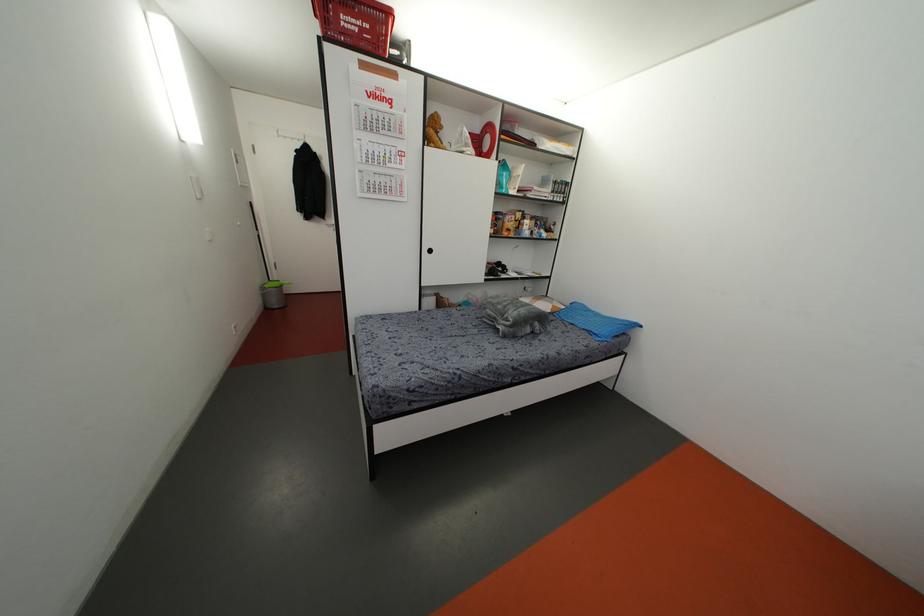
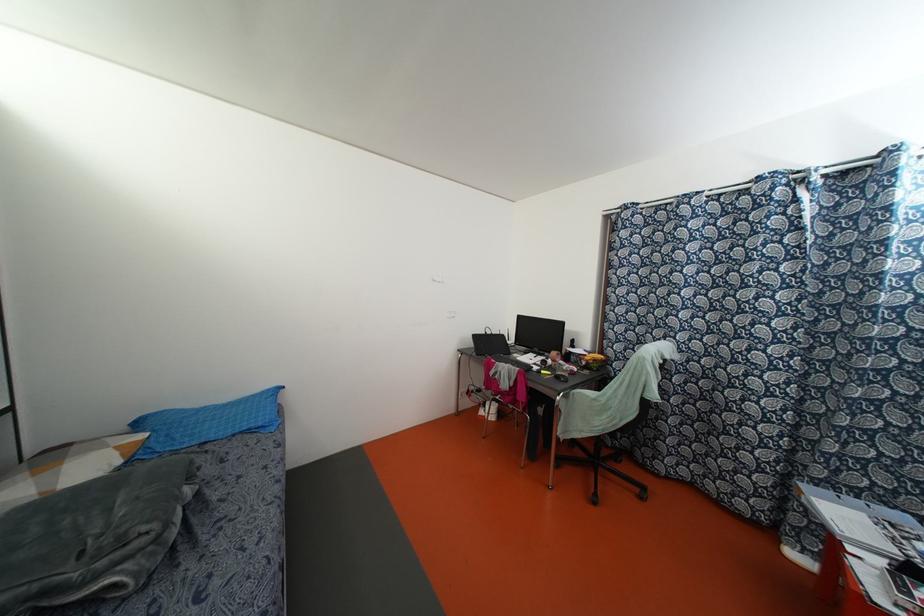
Where in the second image is the point corresponding to (x=548, y=310) from the first image?

(118, 461)